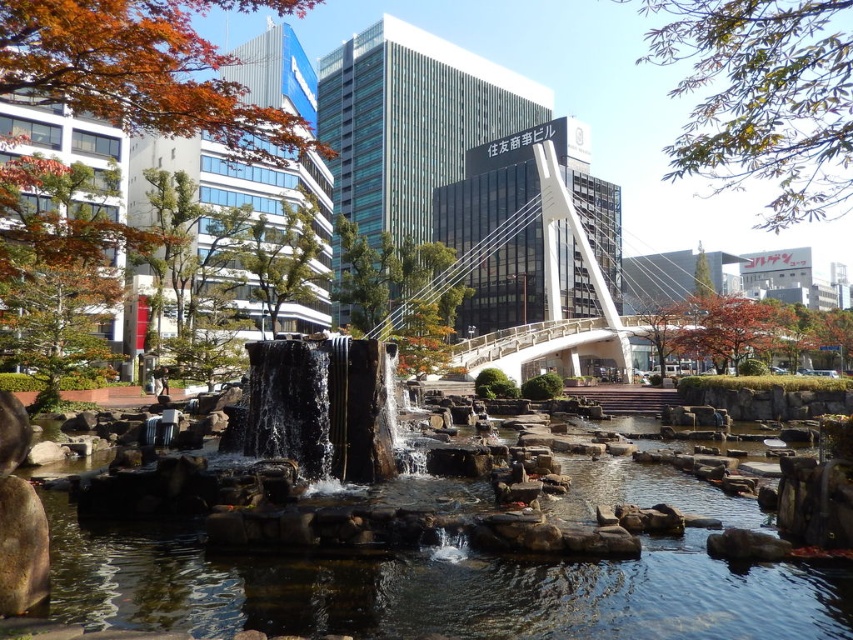
Question: Among these points, which one is farthest from the camera?

Choices:
 (A) (418, 579)
 (B) (505, 332)

Answer: (B)

Question: Does clear water at center appear on the right side of white glass bridge at center?

Choices:
 (A) yes
 (B) no

Answer: (B)

Question: Can you confirm if clear water at center is thinner than white glass bridge at center?

Choices:
 (A) no
 (B) yes

Answer: (B)

Question: Which point appears farthest from the camera in this image?

Choices:
 (A) (514, 570)
 (B) (548, 320)

Answer: (B)

Question: Is clear water at center to the left of white glass bridge at center from the viewer's perspective?

Choices:
 (A) yes
 (B) no

Answer: (A)